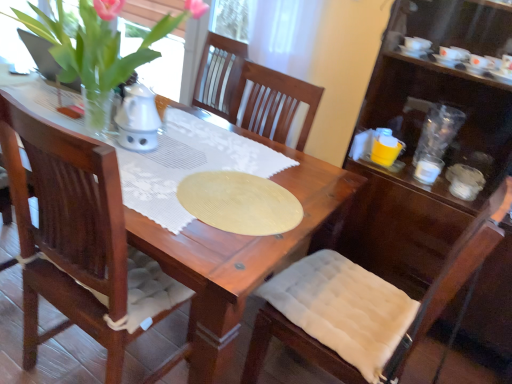
The width and height of the screenshot is (512, 384). Describe the element at coordinates (428, 169) in the screenshot. I see `white glossy cup at right, marked as the first tableware in a bottom-to-top arrangement` at that location.

Find the location of a particular element. The height and width of the screenshot is (384, 512). white fabric cushion at lower right is located at coordinates (364, 306).

What do you see at coordinates (438, 131) in the screenshot?
I see `transparent plastic cups at right, marked as the second tableware in a bottom-to-top arrangement` at bounding box center [438, 131].

Measure the distance between point (69,80) and camera.

Point (69,80) and camera are 4.63 feet apart from each other.

I want to click on white glossy cup at right, the second tableware viewed from the top, so click(428, 169).

At what (x,y) coordinates should I click in order to perform the action: click on tableware that is the 1st object directly below the green leafy plant at upper left (from a real-world perspective). Please return your answer as a coordinate pair (x, y). The height and width of the screenshot is (384, 512). Looking at the image, I should click on (438, 131).

Which is behind, point (444, 129) or point (103, 65)?

The point (444, 129) is farther from the camera.

Who is bigger, transparent plastic cups at right, positioned as the 1th tableware in top-to-bottom order, or green leafy plant at upper left?

green leafy plant at upper left.

Could you measure the distance between transparent plastic cups at right, positioned as the 1th tableware in top-to-bottom order, and green leafy plant at upper left?

transparent plastic cups at right, positioned as the 1th tableware in top-to-bottom order, and green leafy plant at upper left are 4.38 feet apart.

Could you tell me if white fabric cushion at lower right is turned towards green leafy plant at upper left?

Yes, white fabric cushion at lower right is aimed at green leafy plant at upper left.

Considering the relative sizes of white fabric cushion at lower right and green leafy plant at upper left in the image provided, is white fabric cushion at lower right shorter than green leafy plant at upper left?

In fact, white fabric cushion at lower right may be taller than green leafy plant at upper left.

Is green leafy plant at upper left inside white fabric cushion at lower right?

No, white fabric cushion at lower right does not contain green leafy plant at upper left.

Does point (305, 329) lie in front of point (99, 18)?

Yes, it is in front of point (99, 18).

Between point (438, 161) and point (18, 18), which one is positioned behind?

The point (438, 161) is farther.

Between white glossy cup at right, the second tableware viewed from the top, and green leafy plant at upper left, which one has smaller width?

Thinner between the two is white glossy cup at right, the second tableware viewed from the top.

Measure the distance from white glossy cup at right, the second tableware viewed from the top, to green leafy plant at upper left.

A distance of 1.33 meters exists between white glossy cup at right, the second tableware viewed from the top, and green leafy plant at upper left.

Is white glossy cup at right, the second tableware viewed from the top, oriented away from green leafy plant at upper left?

No, white glossy cup at right, the second tableware viewed from the top, is not facing the opposite direction of green leafy plant at upper left.

Between transparent plastic cups at right, marked as the second tableware in a bottom-to-top arrangement, and white glossy cup at right, marked as the first tableware in a bottom-to-top arrangement, which one has smaller width?

With smaller width is white glossy cup at right, marked as the first tableware in a bottom-to-top arrangement.

Can you see transparent plastic cups at right, positioned as the 1th tableware in top-to-bottom order, touching white glossy cup at right, the second tableware viewed from the top?

No, transparent plastic cups at right, positioned as the 1th tableware in top-to-bottom order, is not next to white glossy cup at right, the second tableware viewed from the top.

Is transparent plastic cups at right, marked as the second tableware in a bottom-to-top arrangement, oriented towards white glossy cup at right, the second tableware viewed from the top?

Yes, transparent plastic cups at right, marked as the second tableware in a bottom-to-top arrangement, faces towards white glossy cup at right, the second tableware viewed from the top.

From a real-world perspective, relative to white glossy cup at right, marked as the first tableware in a bottom-to-top arrangement, is transparent plastic cups at right, marked as the second tableware in a bottom-to-top arrangement, vertically above or below?

In terms of real-world spatial position, transparent plastic cups at right, marked as the second tableware in a bottom-to-top arrangement, is above white glossy cup at right, marked as the first tableware in a bottom-to-top arrangement.

From a real-world perspective, is white glossy cup at right, the second tableware viewed from the top, physically located above or below white fabric cushion at lower right?

In terms of real-world spatial position, white glossy cup at right, the second tableware viewed from the top, is above white fabric cushion at lower right.

Is white glossy cup at right, the second tableware viewed from the top, shorter than white fabric cushion at lower right?

Indeed, white glossy cup at right, the second tableware viewed from the top, has a lesser height compared to white fabric cushion at lower right.

Considering the sizes of white glossy cup at right, marked as the first tableware in a bottom-to-top arrangement, and white fabric cushion at lower right in the image, is white glossy cup at right, marked as the first tableware in a bottom-to-top arrangement, bigger or smaller than white fabric cushion at lower right?

Considering their sizes, white glossy cup at right, marked as the first tableware in a bottom-to-top arrangement, takes up less space than white fabric cushion at lower right.

At what (x,y) coordinates should I click in order to perform the action: click on the 1st tableware located above the white fabric cushion at lower right (from a real-world perspective). Please return your answer as a coordinate pair (x, y). This screenshot has height=384, width=512. Looking at the image, I should click on (428, 169).

Which point is more distant from viewer, (105, 64) or (423, 177)?

Positioned behind is point (423, 177).

Find the location of a particular element. tableware that is the 2nd object located below the green leafy plant at upper left (from the image's perspective) is located at coordinates (428, 169).

Would you say green leafy plant at upper left is inside or outside white glossy cup at right, the second tableware viewed from the top?

green leafy plant at upper left lies outside white glossy cup at right, the second tableware viewed from the top.

Considering the positions of objects green leafy plant at upper left and white fabric cushion at lower right in the image provided, who is more to the right, green leafy plant at upper left or white fabric cushion at lower right?

white fabric cushion at lower right is more to the right.

From a real-world perspective, is green leafy plant at upper left over white fabric cushion at lower right?

Yes, from a real-world perspective, green leafy plant at upper left is over white fabric cushion at lower right

Is green leafy plant at upper left smaller than white fabric cushion at lower right?

Correct, green leafy plant at upper left occupies less space than white fabric cushion at lower right.

Is the position of green leafy plant at upper left less distant than that of white fabric cushion at lower right?

No, green leafy plant at upper left is further to the viewer.

Locate an element on the screen. The image size is (512, 384). houseplant on the left side of transparent plastic cups at right, positioned as the 1th tableware in top-to-bottom order is located at coordinates (99, 47).

Where is `houseplant above the white fabric cushion at lower right (from the image's perspective)`? The image size is (512, 384). houseplant above the white fabric cushion at lower right (from the image's perspective) is located at coordinates (99, 47).

Which object lies further to the anchor point white fabric cushion at lower right, white glossy cup at right, marked as the first tableware in a bottom-to-top arrangement, or green leafy plant at upper left?

green leafy plant at upper left.

Which object lies nearer to the anchor point transparent plastic cups at right, marked as the second tableware in a bottom-to-top arrangement, green leafy plant at upper left or white glossy cup at right, marked as the first tableware in a bottom-to-top arrangement?

Among the two, white glossy cup at right, marked as the first tableware in a bottom-to-top arrangement, is located nearer to transparent plastic cups at right, marked as the second tableware in a bottom-to-top arrangement.

Based on their spatial positions, is green leafy plant at upper left or transparent plastic cups at right, marked as the second tableware in a bottom-to-top arrangement, further from white glossy cup at right, the second tableware viewed from the top?

green leafy plant at upper left is further to white glossy cup at right, the second tableware viewed from the top.

When comparing their distances from white fabric cushion at lower right, does transparent plastic cups at right, marked as the second tableware in a bottom-to-top arrangement, or white glossy cup at right, the second tableware viewed from the top, seem closer?

white glossy cup at right, the second tableware viewed from the top, is positioned closer to the anchor white fabric cushion at lower right.

From the image, which object appears to be nearer to green leafy plant at upper left, transparent plastic cups at right, positioned as the 1th tableware in top-to-bottom order, or white glossy cup at right, the second tableware viewed from the top?

white glossy cup at right, the second tableware viewed from the top, is closer to green leafy plant at upper left.

Looking at the image, which one is located further to white glossy cup at right, the second tableware viewed from the top, green leafy plant at upper left or white fabric cushion at lower right?

The object further to white glossy cup at right, the second tableware viewed from the top, is green leafy plant at upper left.

Considering their positions, is white fabric cushion at lower right positioned further to green leafy plant at upper left than white glossy cup at right, marked as the first tableware in a bottom-to-top arrangement?

Among the two, white glossy cup at right, marked as the first tableware in a bottom-to-top arrangement, is located further to green leafy plant at upper left.

When comparing their distances from white glossy cup at right, marked as the first tableware in a bottom-to-top arrangement, does transparent plastic cups at right, marked as the second tableware in a bottom-to-top arrangement, or green leafy plant at upper left seem closer?

transparent plastic cups at right, marked as the second tableware in a bottom-to-top arrangement.

Find the location of a particular element. chair between green leafy plant at upper left and transparent plastic cups at right, positioned as the 1th tableware in top-to-bottom order, in the horizontal direction is located at coordinates (364, 306).

Find the location of a particular element. Image resolution: width=512 pixels, height=384 pixels. chair situated between green leafy plant at upper left and white glossy cup at right, the second tableware viewed from the top, from left to right is located at coordinates (x=364, y=306).

Locate an element on the screen. The width and height of the screenshot is (512, 384). tableware located between green leafy plant at upper left and transparent plastic cups at right, marked as the second tableware in a bottom-to-top arrangement, in the left-right direction is located at coordinates (428, 169).

Identify the location of tableware between white fabric cushion at lower right and transparent plastic cups at right, positioned as the 1th tableware in top-to-bottom order, along the z-axis. Image resolution: width=512 pixels, height=384 pixels. (428, 169).